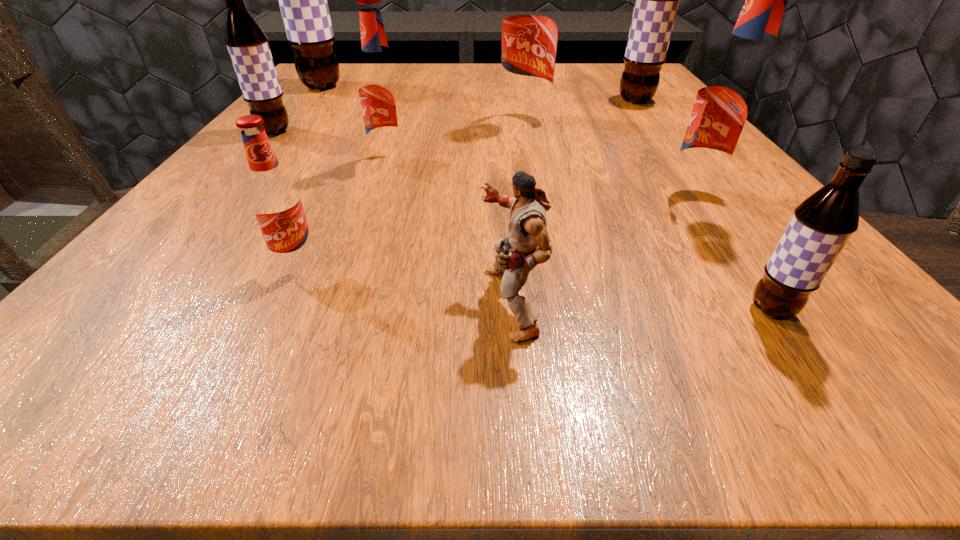
At what (x,y) coordinates should I click in order to perform the action: click on the nearest red root beer. Please return your answer as a coordinate pair (x, y). Looking at the image, I should click on (275, 200).

Where is `the nearest root beer`? This screenshot has height=540, width=960. the nearest root beer is located at coordinates (822, 224).

Locate an element on the screen. the nearest brown root beer is located at coordinates (822, 224).

Identify the location of puncher. (527, 245).

You are a GUI agent. You are given a task and a screenshot of the screen. Output one action in this format:
    pyautogui.click(x=<x>, y=<y>)
    Task: Click on the vacant space situated on the right of the biggest brown root beer
    This screenshot has height=540, width=960.
    Given the screenshot: What is the action you would take?
    pyautogui.click(x=512, y=86)

The height and width of the screenshot is (540, 960). Find the location of `blank space located 0.280m on the front of the farthest red root beer`. blank space located 0.280m on the front of the farthest red root beer is located at coordinates (541, 213).

Find the location of `free space located 0.240m on the front of the second biggest brown root beer`. free space located 0.240m on the front of the second biggest brown root beer is located at coordinates (680, 159).

Find the location of a particular element. vacant space situated on the front of the sixth farthest root beer is located at coordinates (738, 256).

Identify the location of free space located on the front of the second smallest brown root beer. (152, 275).

Locate an element on the screen. This screenshot has width=960, height=540. vacant space situated on the right of the fifth nearest object is located at coordinates (512, 161).